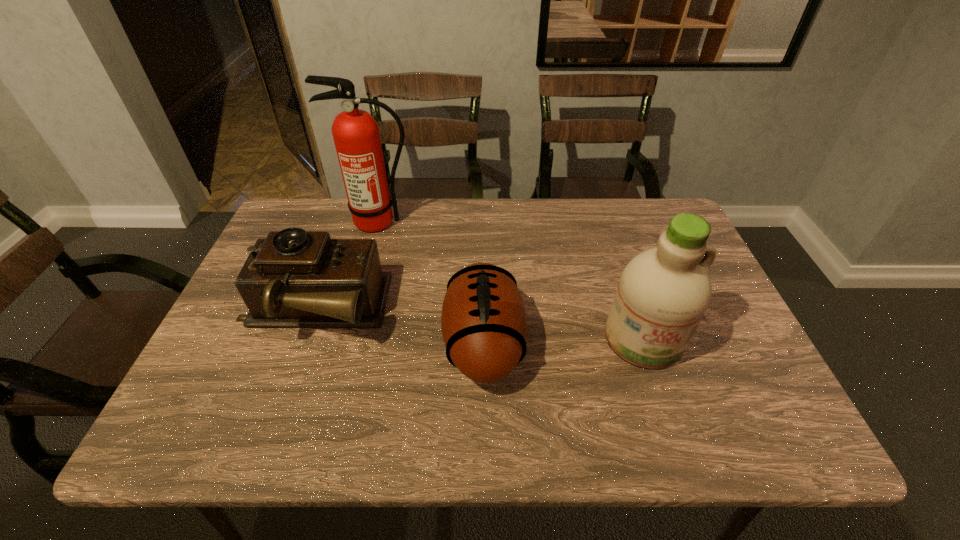
I want to click on free point between the cleansing agent and the second object from right to left, so click(x=564, y=341).

Find the location of a particular element. The image size is (960, 540). unoccupied area between the third object from left to right and the third shortest object is located at coordinates (564, 341).

Select which object appears as the closest to the third tallest object. Please provide its 2D coordinates. Your answer should be formatted as a tuple, i.e. [(x, y)], where the tuple contains the x and y coordinates of a point satisfying the conditions above.

[(484, 325)]

Select which object is the third closest to the football (American). Please provide its 2D coordinates. Your answer should be formatted as a tuple, i.e. [(x, y)], where the tuple contains the x and y coordinates of a point satisfying the conditions above.

[(356, 135)]

Identify the location of blank area in the image that satisfies the following two spatial constraints: 1. on the horn of the shortest object; 2. on the left side of the phonograph_record. (301, 342).

You are a GUI agent. You are given a task and a screenshot of the screen. Output one action in this format:
    pyautogui.click(x=<x>, y=<y>)
    Task: Click on the free spot that satisfies the following two spatial constraints: 1. on the handle side of the tallest object; 2. on the horn of the phonograph_record
    The height and width of the screenshot is (540, 960).
    Given the screenshot: What is the action you would take?
    pyautogui.click(x=354, y=310)

Image resolution: width=960 pixels, height=540 pixels. I want to click on vacant area that satisfies the following two spatial constraints: 1. on the horn of the phonograph_record; 2. on the right side of the football (American), so (x=301, y=342).